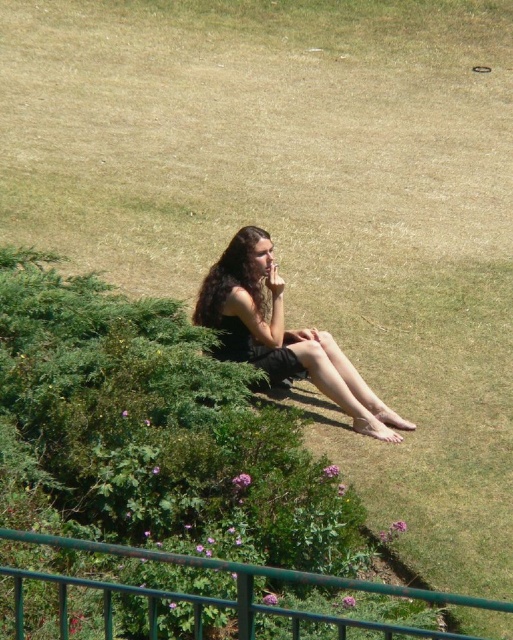
Question: Which point appears farthest from the camera in this image?

Choices:
 (A) (149, 605)
 (B) (369, 419)

Answer: (B)

Question: Which object is closer to the camera taking this photo?

Choices:
 (A) green metal railing at lower center
 (B) dark brown hair at center

Answer: (A)

Question: Is dark brown hair at center smaller than green metal railing at lower center?

Choices:
 (A) no
 (B) yes

Answer: (B)

Question: Which point is closer to the camera?

Choices:
 (A) (166, 554)
 (B) (265, 339)

Answer: (A)

Question: Can you confirm if dark brown hair at center is positioned below green metal railing at lower center?

Choices:
 (A) no
 (B) yes

Answer: (A)

Question: Does dark brown hair at center have a lesser width compared to green metal railing at lower center?

Choices:
 (A) yes
 (B) no

Answer: (A)